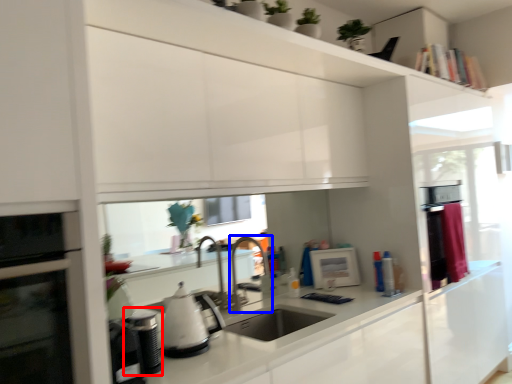
Question: Which object appears farthest to the camera in this image, appliance (highlighted by a red box) or faucet (highlighted by a blue box)?

Choices:
 (A) appliance
 (B) faucet

Answer: (B)